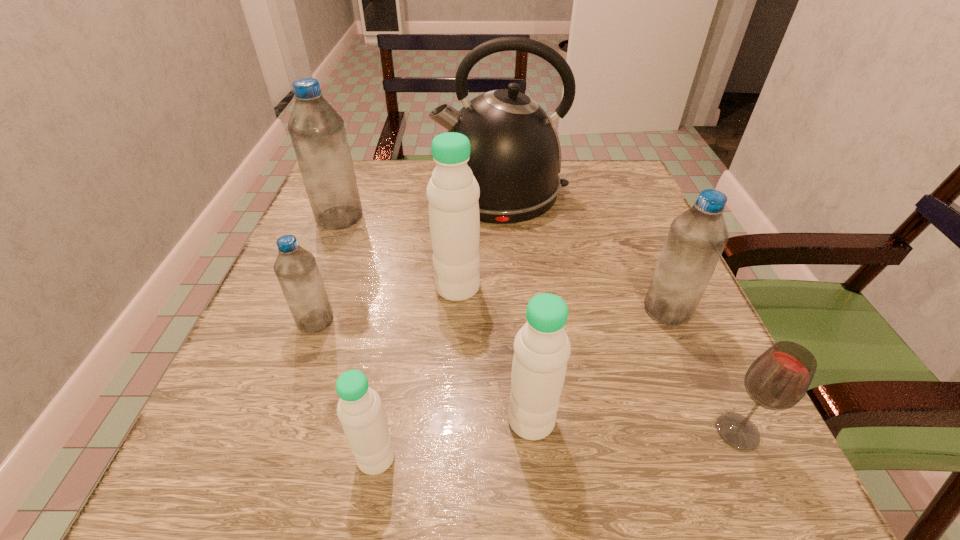
Identify the location of kettle. (515, 156).

Image resolution: width=960 pixels, height=540 pixels. In order to click on the farthest blue water bottle in this screenshot , I will do `click(317, 131)`.

Where is `the biggest blue water bottle`? Image resolution: width=960 pixels, height=540 pixels. the biggest blue water bottle is located at coordinates (317, 131).

Locate an element on the screen. the second white water bottle from left to right is located at coordinates (453, 192).

The image size is (960, 540). Identify the location of the fourth water bottle from left to right. (453, 192).

At what (x,y) coordinates should I click in order to perform the action: click on the rightmost water bottle. Please return your answer as a coordinate pair (x, y). Looking at the image, I should click on (696, 239).

Where is `the rightmost blue water bottle`? The width and height of the screenshot is (960, 540). the rightmost blue water bottle is located at coordinates (696, 239).

Where is `the rightmost white water bottle`? the rightmost white water bottle is located at coordinates (542, 348).

Where is `the second water bottle from right to left`? the second water bottle from right to left is located at coordinates (542, 348).

The image size is (960, 540). I want to click on the smallest blue water bottle, so click(296, 269).